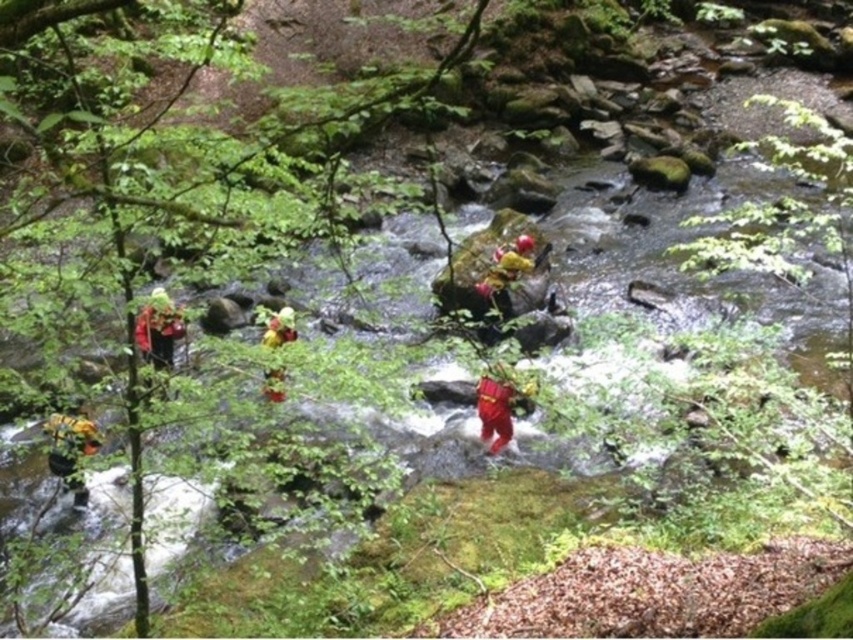
You are a drone operator trying to capture aerial footage of the rescue team in the forest. Your drone has a maximum range of 8 meters. You see the matte red helmet at left in the scene. Can your drone safely transmit video while hovering directly above it?

The matte red helmet at left is 8.46 meters from camera. Since the drone can only reach 8 meters, it cannot safely transmit video while hovering directly above the matte red helmet at left as it is beyond the drone range.